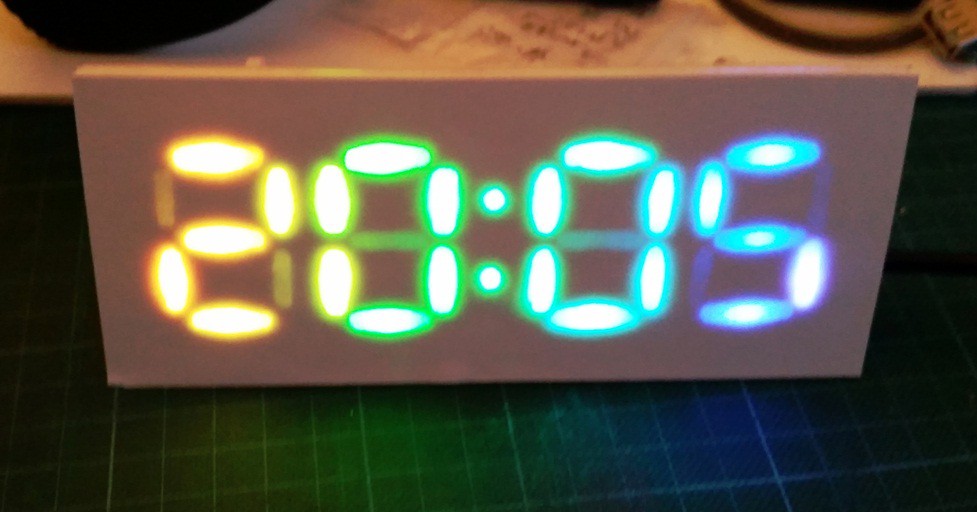
I want to click on dark green and gray striped fabric, so click(x=520, y=479).